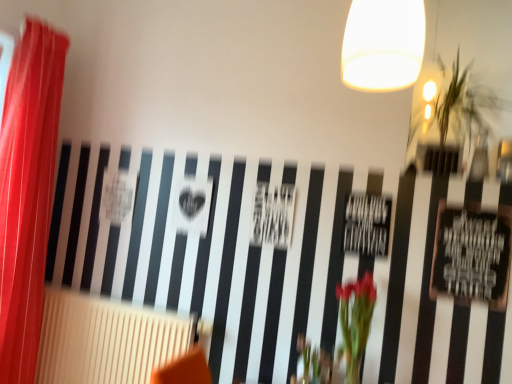
Question: Does beige textured radiator at lower left turn towards green leafy vase at center?

Choices:
 (A) no
 (B) yes

Answer: (A)

Question: Is beige textured radiator at lower left located outside green leafy vase at center?

Choices:
 (A) yes
 (B) no

Answer: (A)

Question: Does beige textured radiator at lower left have a smaller size compared to green leafy vase at center?

Choices:
 (A) yes
 (B) no

Answer: (B)

Question: From the image's perspective, does beige textured radiator at lower left appear higher than green leafy vase at center?

Choices:
 (A) no
 (B) yes

Answer: (A)

Question: Is the position of beige textured radiator at lower left more distant than that of green leafy vase at center?

Choices:
 (A) yes
 (B) no

Answer: (A)

Question: From a real-world perspective, is beige textured radiator at lower left positioned under green leafy vase at center based on gravity?

Choices:
 (A) yes
 (B) no

Answer: (A)

Question: Does beige textured radiator at lower left have a greater height compared to red sheer curtain at left?

Choices:
 (A) yes
 (B) no

Answer: (B)

Question: From the image's perspective, is beige textured radiator at lower left above red sheer curtain at left?

Choices:
 (A) yes
 (B) no

Answer: (B)

Question: Is beige textured radiator at lower left looking in the opposite direction of red sheer curtain at left?

Choices:
 (A) yes
 (B) no

Answer: (B)

Question: Can you confirm if beige textured radiator at lower left is smaller than red sheer curtain at left?

Choices:
 (A) yes
 (B) no

Answer: (A)

Question: Considering the relative sizes of beige textured radiator at lower left and red sheer curtain at left in the image provided, is beige textured radiator at lower left bigger than red sheer curtain at left?

Choices:
 (A) no
 (B) yes

Answer: (A)

Question: Considering the relative positions of beige textured radiator at lower left and red sheer curtain at left in the image provided, is beige textured radiator at lower left in front of red sheer curtain at left?

Choices:
 (A) no
 (B) yes

Answer: (A)

Question: From a real-world perspective, does red sheer curtain at left stand above green leafy vase at center?

Choices:
 (A) no
 (B) yes

Answer: (B)